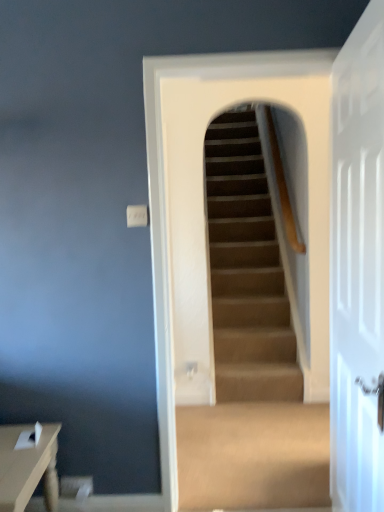
Question: Is white glossy door at right facing towards matte brown table at lower left?

Choices:
 (A) no
 (B) yes

Answer: (B)

Question: Is white glossy door at right closer to camera compared to matte brown table at lower left?

Choices:
 (A) no
 (B) yes

Answer: (B)

Question: Is white glossy door at right not inside matte brown table at lower left?

Choices:
 (A) yes
 (B) no

Answer: (A)

Question: Considering the relative sizes of white glossy door at right and matte brown table at lower left in the image provided, is white glossy door at right shorter than matte brown table at lower left?

Choices:
 (A) yes
 (B) no

Answer: (B)

Question: Is white glossy door at right taller than matte brown table at lower left?

Choices:
 (A) no
 (B) yes

Answer: (B)

Question: Looking at their shapes, would you say white glossy door at right is wider or thinner than carpeted stairs at center?

Choices:
 (A) thin
 (B) wide

Answer: (A)

Question: Considering the positions of point (360, 301) and point (223, 354), is point (360, 301) closer or farther from the camera than point (223, 354)?

Choices:
 (A) farther
 (B) closer

Answer: (B)

Question: From the image's perspective, is white glossy door at right positioned above or below carpeted stairs at center?

Choices:
 (A) below
 (B) above

Answer: (A)

Question: Based on their sizes in the image, would you say white glossy door at right is bigger or smaller than carpeted stairs at center?

Choices:
 (A) big
 (B) small

Answer: (B)

Question: Is carpeted stairs at center spatially inside matte brown table at lower left, or outside of it?

Choices:
 (A) inside
 (B) outside

Answer: (B)

Question: Looking at their shapes, would you say carpeted stairs at center is wider or thinner than matte brown table at lower left?

Choices:
 (A) thin
 (B) wide

Answer: (A)

Question: From a real-world perspective, is carpeted stairs at center physically located above or below matte brown table at lower left?

Choices:
 (A) below
 (B) above

Answer: (B)

Question: From the image's perspective, is carpeted stairs at center located above or below matte brown table at lower left?

Choices:
 (A) below
 (B) above

Answer: (B)

Question: Does point (48, 473) appear closer or farther from the camera than point (375, 225)?

Choices:
 (A) closer
 (B) farther

Answer: (B)

Question: In the image, is matte brown table at lower left on the left side or the right side of white glossy door at right?

Choices:
 (A) left
 (B) right

Answer: (A)